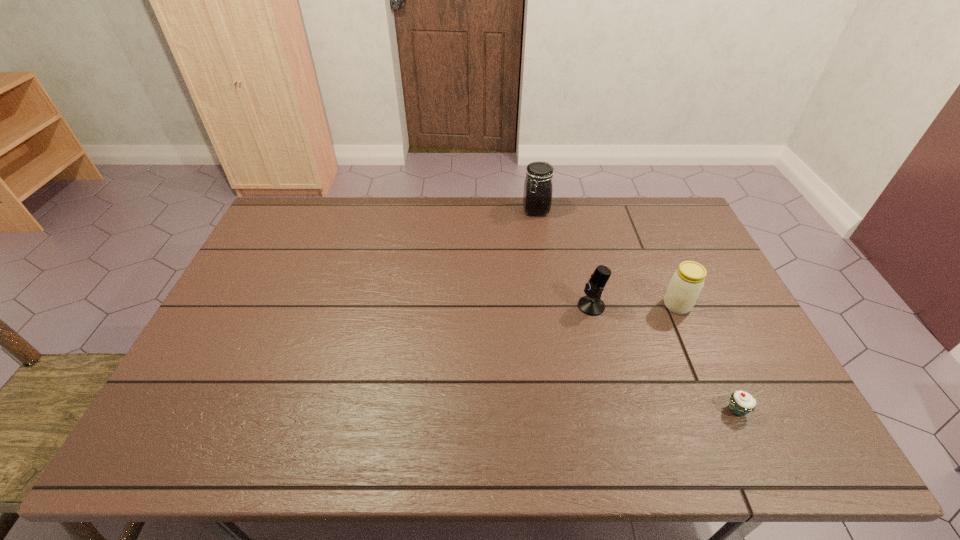
Identify the location of the left jar. The width and height of the screenshot is (960, 540). (537, 197).

The image size is (960, 540). I want to click on the tallest object, so click(x=537, y=197).

At what (x,y) coordinates should I click in order to perform the action: click on microphone. Please return your answer as a coordinate pair (x, y). Looking at the image, I should click on (591, 304).

This screenshot has height=540, width=960. I want to click on the right jar, so click(686, 284).

Locate an element on the screen. This screenshot has width=960, height=540. the nearer jar is located at coordinates (686, 284).

Where is `the shortest object`? the shortest object is located at coordinates (740, 403).

You are a GUI agent. You are given a task and a screenshot of the screen. Output one action in this format:
    pyautogui.click(x=<x>, y=<y>)
    Task: Click on the nearest object
    The height and width of the screenshot is (540, 960).
    Given the screenshot: What is the action you would take?
    pyautogui.click(x=740, y=403)

I want to click on free space located on the lid of the farther jar, so 540,241.

The width and height of the screenshot is (960, 540). What are the coordinates of `vacant space located on the stand of the microphone` in the screenshot? It's located at (547, 306).

What are the coordinates of `vacant region located on the stand of the microphone` in the screenshot? It's located at (554, 306).